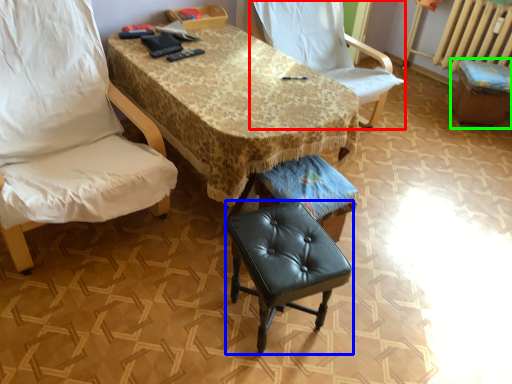
Question: Which is nearer to the chair (highlighted by a red box)? stool (highlighted by a blue box) or bar stool (highlighted by a green box).

Choices:
 (A) stool
 (B) bar stool

Answer: (B)